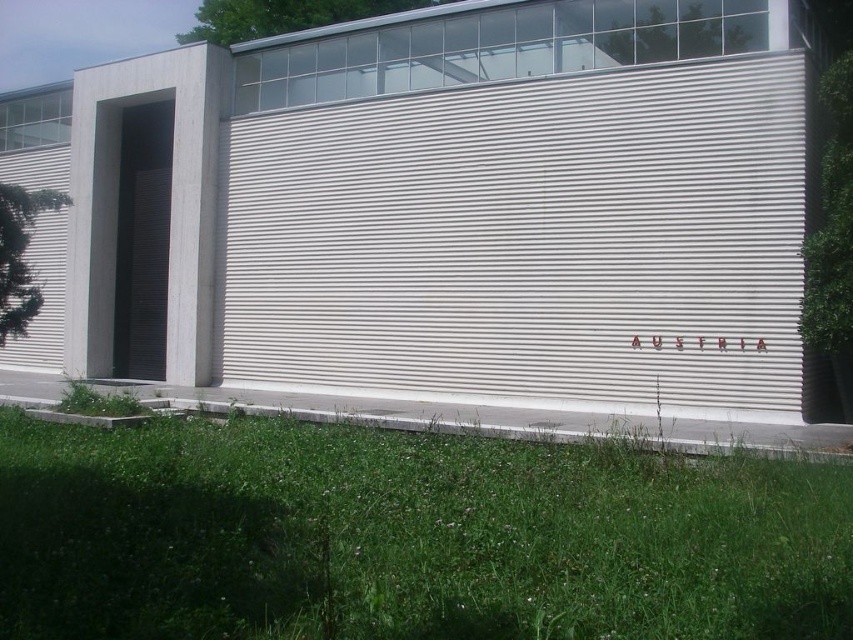
Who is taller, white corrugated metal at center or green grass at lower center?

white corrugated metal at center

Between white corrugated metal at center and green grass at lower center, which one appears on the left side from the viewer's perspective?

white corrugated metal at center is more to the left.

Describe the element at coordinates (526, 237) in the screenshot. I see `white corrugated metal at center` at that location.

Where is `white corrugated metal at center`? The height and width of the screenshot is (640, 853). white corrugated metal at center is located at coordinates (526, 237).